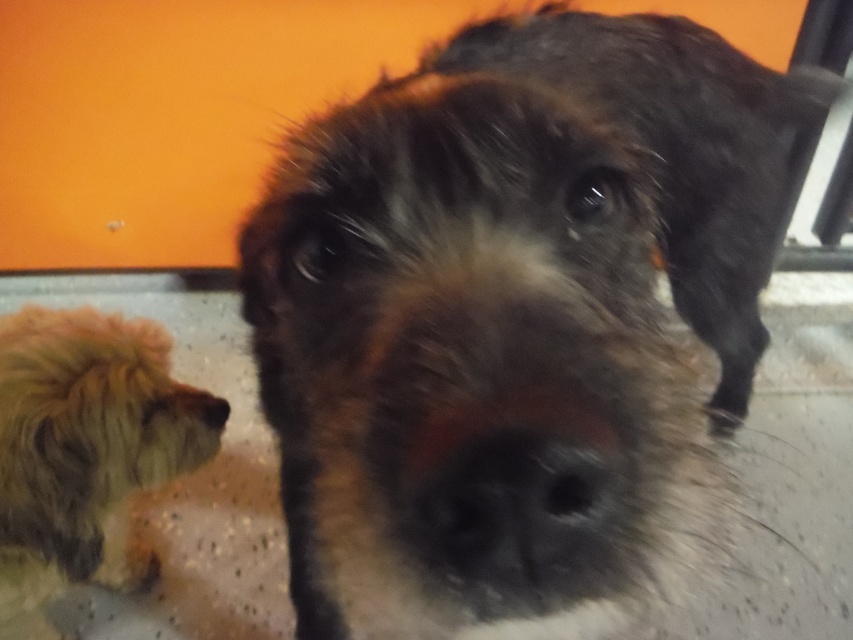
How far apart are fuzzy brown dog at lower left and brown fuzzy nose at lower left?

fuzzy brown dog at lower left is 7.85 inches from brown fuzzy nose at lower left.

Who is taller, fuzzy brown dog at lower left or brown fuzzy nose at lower left?

fuzzy brown dog at lower left is taller.

Is point (49, 547) behind point (227, 408)?

No, (49, 547) is closer to viewer.

What are the coordinates of `fuzzy brown dog at lower left` in the screenshot? It's located at (84, 448).

Can you confirm if brown fuzzy dog at center is smaller than fuzzy brown dog at lower left?

No.

Is brown fuzzy dog at center positioned before fuzzy brown dog at lower left?

Yes, brown fuzzy dog at center is closer to the viewer.

Which is in front, point (368, 262) or point (84, 570)?

Point (368, 262) is more forward.

I want to click on brown fuzzy dog at center, so click(x=512, y=317).

Does brown fuzzy dog at center appear on the left side of brown fuzzy nose at lower left?

In fact, brown fuzzy dog at center is to the right of brown fuzzy nose at lower left.

Is point (537, 483) more distant than point (206, 406)?

That is False.

Who is more forward, (738, 243) or (202, 404)?

Point (202, 404) is in front.

Identify the location of brown fuzzy dog at center. The image size is (853, 640). (512, 317).